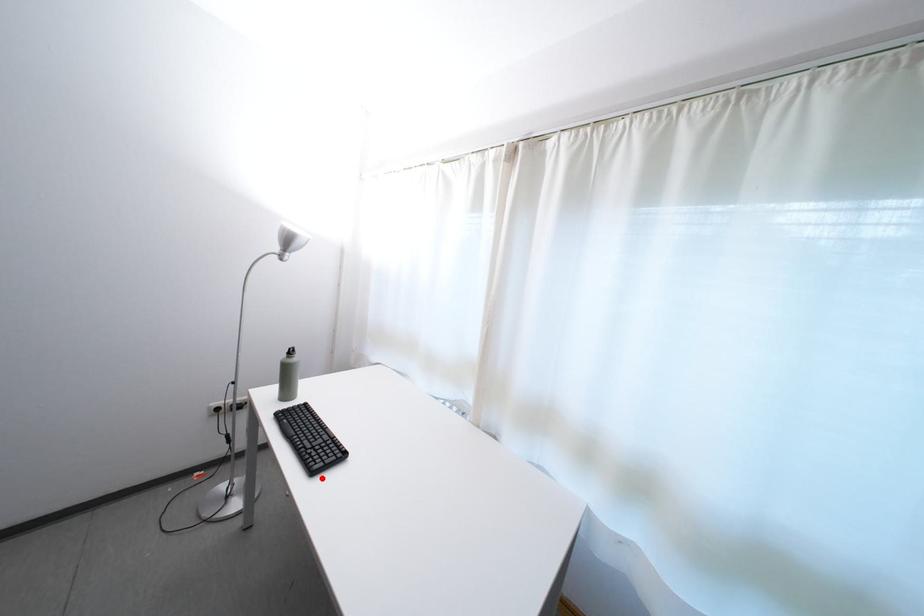
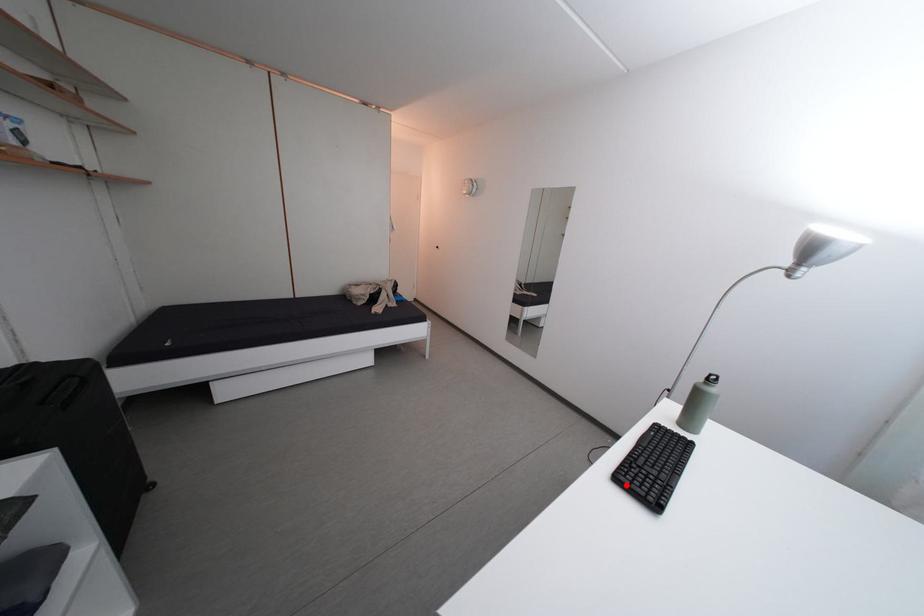
Consider the image. I am providing you with two images of the same scene from different viewpoints. A red point is marked on the first image and another point is marked on the second image. Is the red point in image1 aligned with the point shown in image2?

Yes